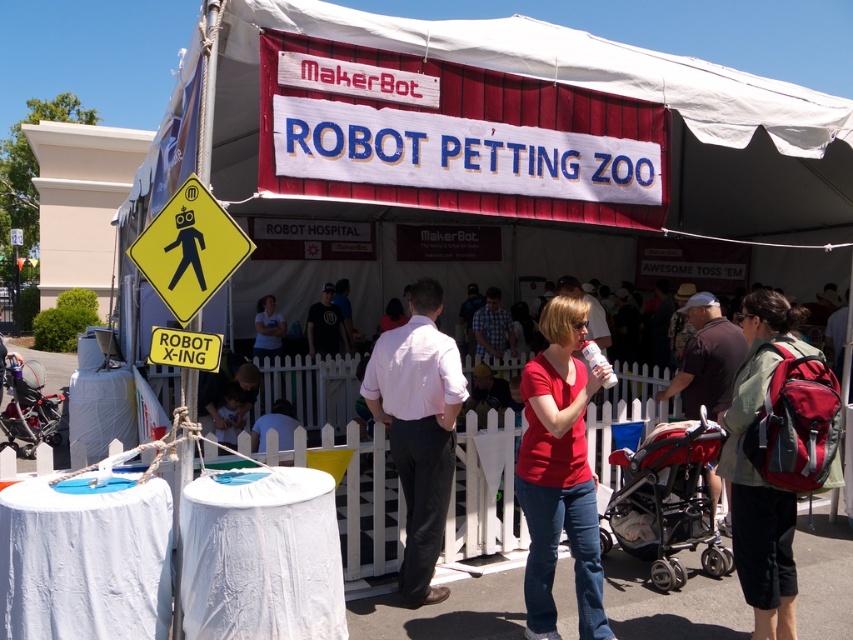
Is point (602, 630) closer to camera compared to point (492, 342)?

That is True.

Is matte red shirt at center shorter than plaid shirt at center?

In fact, matte red shirt at center may be taller than plaid shirt at center.

Is point (584, 340) farther from viewer compared to point (495, 337)?

No, it is in front of (495, 337).

At what (x,y) coordinates should I click in order to perform the action: click on matte red shirt at center. Please return your answer as a coordinate pair (x, y). Image resolution: width=853 pixels, height=640 pixels. Looking at the image, I should click on pyautogui.click(x=560, y=474).

Is matte red shirt at center in front of matte black shirt at center?

Yes.

Between point (577, 426) and point (213, 390), which one is positioned behind?

The point (213, 390) is more distant.

Who is more forward, (x=572, y=502) or (x=210, y=404)?

Positioned in front is point (x=572, y=502).

The width and height of the screenshot is (853, 640). Identify the location of matte red shirt at center. (560, 474).

Is white picket fence at center further to camera compared to dark blue shirt at center?

No.

This screenshot has height=640, width=853. What do you see at coordinates (485, 490) in the screenshot?
I see `white picket fence at center` at bounding box center [485, 490].

Locate an element on the screen. Image resolution: width=853 pixels, height=640 pixels. white picket fence at center is located at coordinates (485, 490).